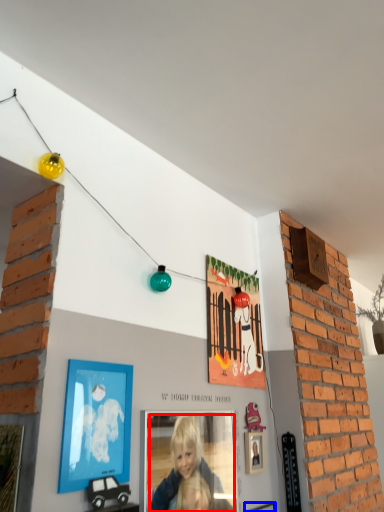
Question: Which of the following is the farthest to the observer, person (highlighted by a red box) or picture frame (highlighted by a blue box)?

Choices:
 (A) person
 (B) picture frame

Answer: (B)